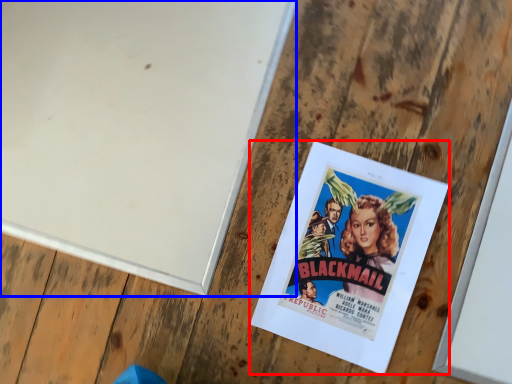
Question: Among these objects, which one is farthest to the camera, poster (highlighted by a red box) or bulletin board (highlighted by a blue box)?

Choices:
 (A) poster
 (B) bulletin board

Answer: (B)